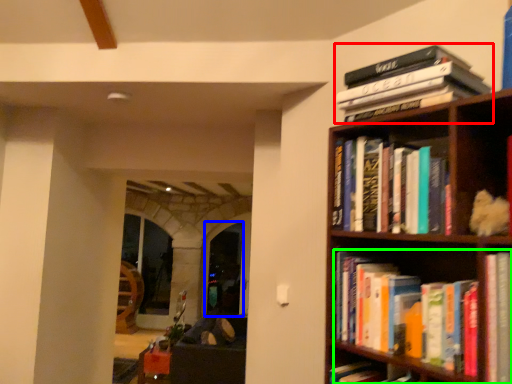
Question: Which is nearer to the book (highlighted by a red box)? glass door (highlighted by a blue box) or book (highlighted by a green box).

Choices:
 (A) glass door
 (B) book

Answer: (B)